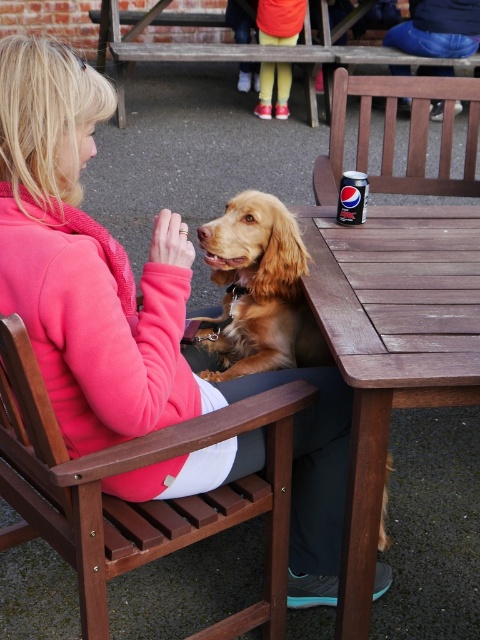
Find the location of a particular element. This screenshot has height=640, width=480. pink fleece jacket at center is located at coordinates (132, 307).

Is pink fleece jacket at center to the right of brown wooden table at center from the viewer's perspective?

In fact, pink fleece jacket at center is to the left of brown wooden table at center.

Which is behind, point (40, 129) or point (373, 496)?

Point (373, 496)

Identify the location of pink fleece jacket at center. (132, 307).

Does brown wooden table at center have a lesser width compared to golden brown fur at center?

No.

You are a GUI agent. You are given a task and a screenshot of the screen. Output one action in this format:
    pyautogui.click(x=<x>, y=<y>)
    Task: Click on the brown wooden table at center
    This screenshot has width=480, height=640.
    Given the screenshot: What is the action you would take?
    pyautogui.click(x=392, y=346)

Can you confirm if pink fleece jacket at center is bigger than golden brown fur at center?

Yes.

Which is behind, point (7, 65) or point (283, 280)?

Positioned behind is point (283, 280).

Find the location of a particular element. The height and width of the screenshot is (640, 480). pink fleece jacket at center is located at coordinates (132, 307).